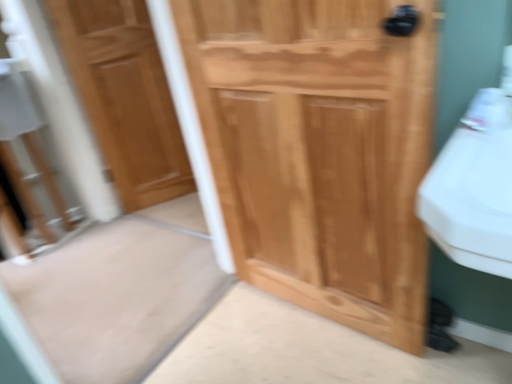
At what (x,y) coordinates should I click in order to perform the action: click on vacant area in front of natural wood cabinet at center, the second door when ordered from left to right. Please return your answer as a coordinate pair (x, y). The width and height of the screenshot is (512, 384). Looking at the image, I should click on (327, 357).